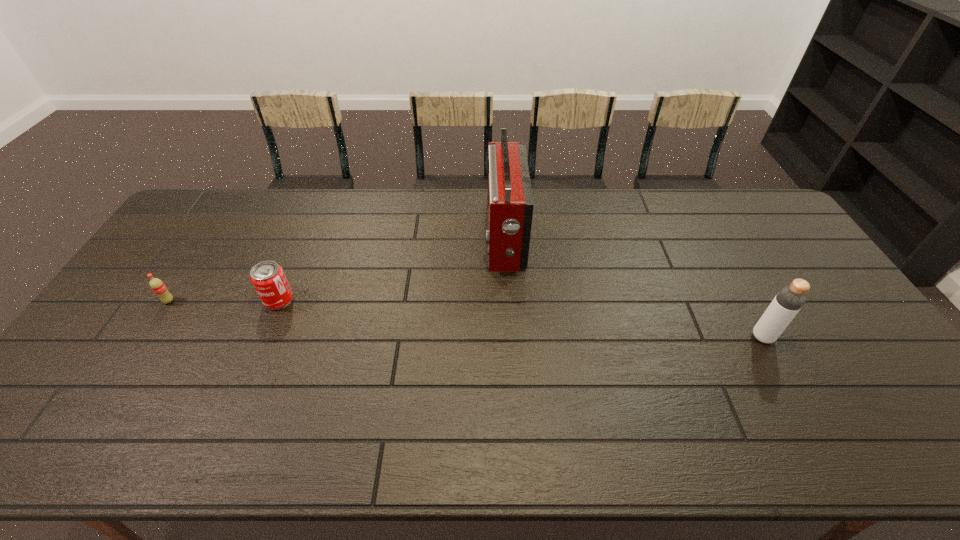
Locate an element on the screen. free space that satisfies the following two spatial constraints: 1. on the front-facing side of the farthest object; 2. on the front side of the can is located at coordinates (508, 300).

Identify the location of free spot that satisfies the following two spatial constraints: 1. on the front-facing side of the second object from right to left; 2. on the front side of the can. tap(508, 300).

Locate an element on the screen. The height and width of the screenshot is (540, 960). vacant region that satisfies the following two spatial constraints: 1. on the front-facing side of the radio receiver; 2. on the right side of the rightmost object is located at coordinates (510, 337).